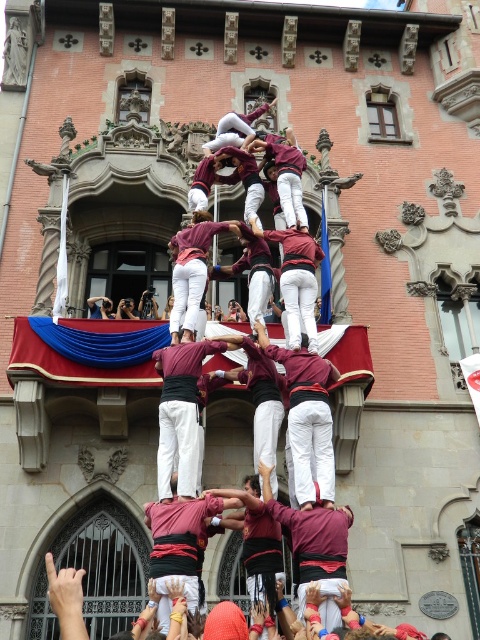
Question: Is the position of maroon fabric at center less distant than that of maroon fabric man at center?

Choices:
 (A) no
 (B) yes

Answer: (B)

Question: Which point is farther to the camera?

Choices:
 (A) (x=149, y=509)
 (B) (x=326, y=552)

Answer: (A)

Question: Which of the following is the closest to the observer?

Choices:
 (A) (151, 573)
 (B) (303, 529)

Answer: (A)

Question: Can you confirm if maroon fabric at center is positioned above maroon fabric man at center?

Choices:
 (A) yes
 (B) no

Answer: (B)

Question: Is maroon fabric at center closer to camera compared to maroon fabric man at center?

Choices:
 (A) no
 (B) yes

Answer: (B)